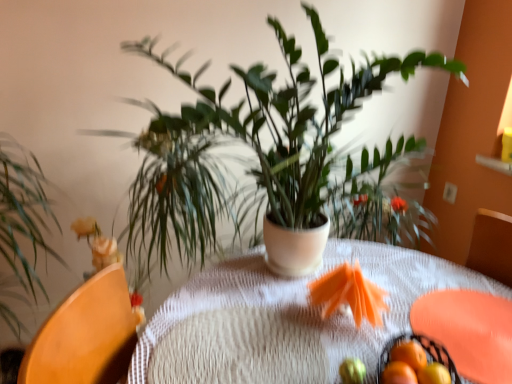
Identify the location of vacant space behind smooth yellow fruit at center. The width and height of the screenshot is (512, 384). (306, 334).